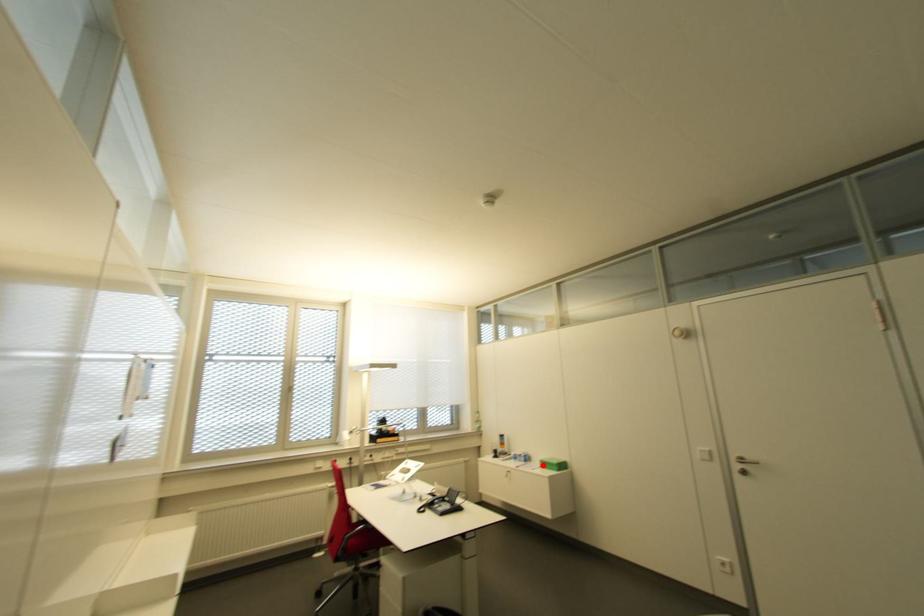
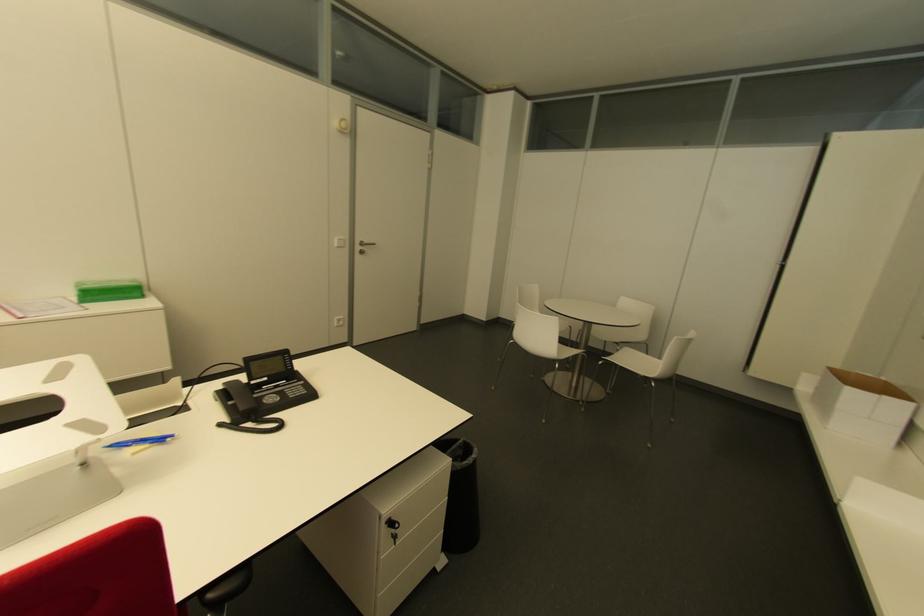
Find the pixel in the second image that matches the highlighted location in the first image.

(92, 294)